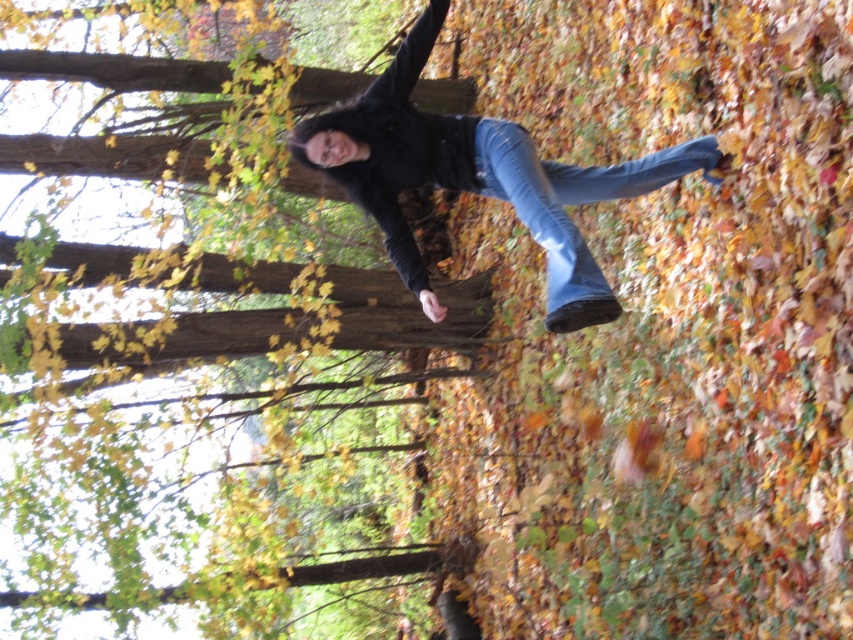
Which is in front, point (492, 141) or point (560, 177)?

Point (492, 141)

Can you confirm if denim jeans at center is smaller than blue denim jeans at center?

No.

Is point (409, 145) positioned after point (531, 216)?

That is True.

This screenshot has height=640, width=853. Find the location of `denim jeans at center`. denim jeans at center is located at coordinates (477, 177).

Does denim jeans at center come in front of brown wood tree at center?

That is True.

Between denim jeans at center and brown wood tree at center, which one appears on the left side from the viewer's perspective?

brown wood tree at center is more to the left.

Does point (582, 195) come closer to viewer compared to point (355, 317)?

That is True.

What are the coordinates of `denim jeans at center` in the screenshot? It's located at (477, 177).

Between blue denim jeans at center and brown wood tree at center, which one has more height?

blue denim jeans at center is taller.

Does point (613, 173) come farther from viewer compared to point (370, 275)?

No, it is not.

Where is `blue denim jeans at center`? The width and height of the screenshot is (853, 640). blue denim jeans at center is located at coordinates point(570,196).